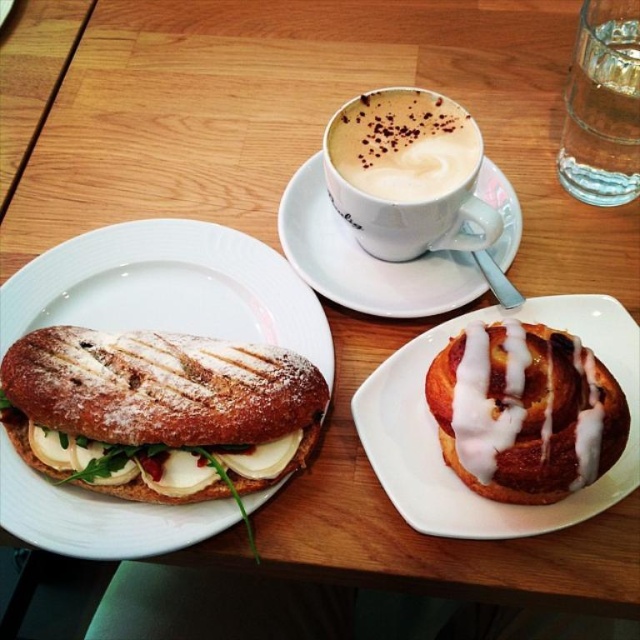
Question: Is the position of white ceramic plate at left less distant than that of white frothy coffee at upper center?

Choices:
 (A) yes
 (B) no

Answer: (A)

Question: Can you confirm if glazed pastry at center is positioned to the left of clear glass water at upper right?

Choices:
 (A) yes
 (B) no

Answer: (A)

Question: Which point appears farthest from the camera in this image?

Choices:
 (A) (48, 515)
 (B) (429, 113)
 (C) (589, 193)

Answer: (C)

Question: Which point is closer to the camera?

Choices:
 (A) white frothy coffee at upper center
 (B) white ceramic plate at left

Answer: (B)

Question: Which is farther from the white frothy coffee at upper center?

Choices:
 (A) white ceramic plate at left
 (B) white ceramic saucer at upper center
 (C) clear glass water at upper right

Answer: (A)

Question: Is white ceramic plate at left thinner than glazed pastry at center?

Choices:
 (A) no
 (B) yes

Answer: (A)